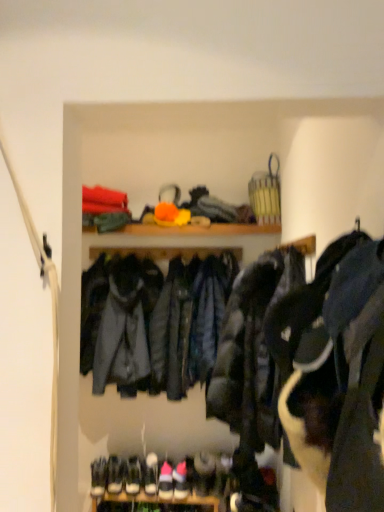
Question: From a real-world perspective, is white leather sneaker at lower center, marked as the 2th shoe in a right-to-left arrangement, positioned above or below white suede sneaker at lower center, which is the second footwear in right-to-left order?

Choices:
 (A) above
 (B) below

Answer: (A)

Question: Considering the positions of white leather sneaker at lower center, placed as the first shoe when sorted from left to right, and white suede sneaker at lower center, marked as the second footwear in a left-to-right arrangement, in the image, is white leather sneaker at lower center, placed as the first shoe when sorted from left to right, wider or thinner than white suede sneaker at lower center, marked as the second footwear in a left-to-right arrangement,?

Choices:
 (A) thin
 (B) wide

Answer: (A)

Question: Estimate the real-world distances between objects in this image. Which object is closer to the white suede sneakers at lower center, the first footwear when ordered from left to right?

Choices:
 (A) yellow fabric basket at upper center
 (B) white leather sneaker at lower center, placed as the first shoe when sorted from left to right
 (C) dark gray puffer jacket at center, marked as the second jacket in a back-to-front arrangement
 (D) white suede sneaker at lower center, marked as the second footwear in a left-to-right arrangement
 (E) white suede sneakers at lower center, placed as the first footwear when sorted from right to left

Answer: (D)

Question: Which of these objects is positioned closest to the white leather sneaker at lower center, which is the 1th shoe in right-to-left order?

Choices:
 (A) white leather sneaker at lower center, marked as the 2th shoe in a right-to-left arrangement
 (B) dark gray puffer jacket at center, placed as the 1th jacket when sorted from front to back
 (C) white suede sneakers at lower center, placed as the first footwear when sorted from right to left
 (D) white suede sneaker at lower center, which is the second footwear in right-to-left order
 (E) dark blue leather jacket at center, acting as the second jacket starting from the front

Answer: (A)